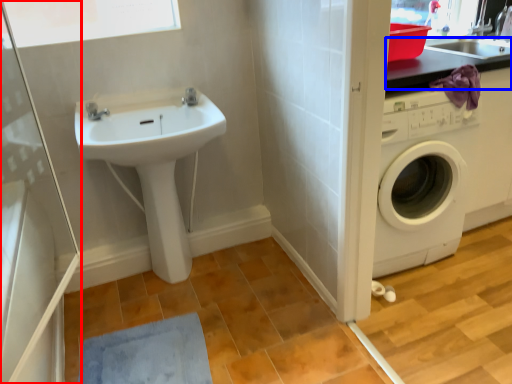
Question: Which of the following is the farthest to the observer, screen door (highlighted by a red box) or counter top (highlighted by a blue box)?

Choices:
 (A) screen door
 (B) counter top

Answer: (B)